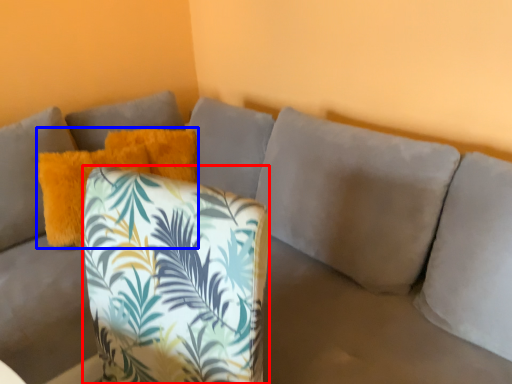
Question: Among these objects, which one is farthest to the camera, throw pillow (highlighted by a red box) or pillow (highlighted by a blue box)?

Choices:
 (A) throw pillow
 (B) pillow

Answer: (B)